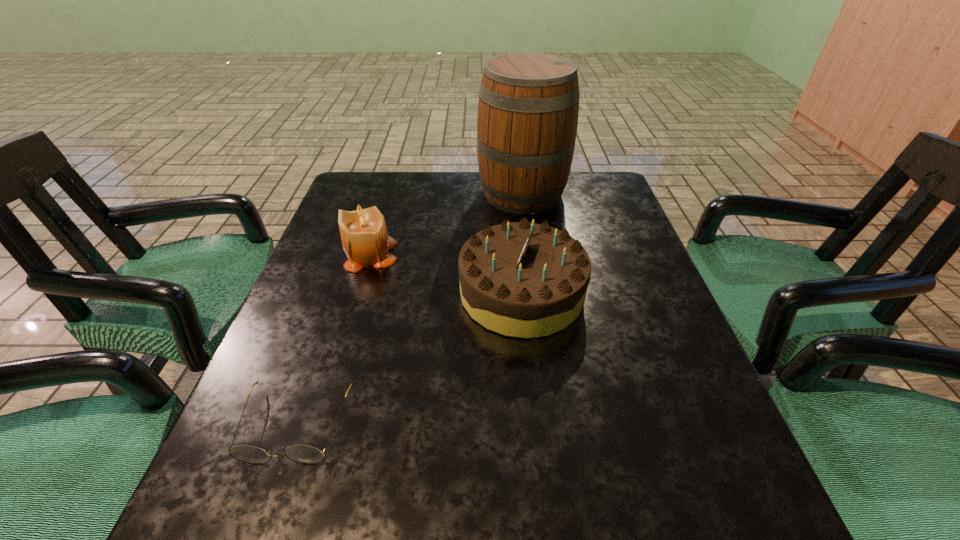
I want to click on blank space at the right edge of the desktop, so click(623, 247).

The width and height of the screenshot is (960, 540). In the image, there is a desktop. Identify the location of vacant space at the far left corner. (351, 210).

Find the location of a particular element. vacant space that is in between the candle and the birthday cake is located at coordinates (446, 274).

Where is `vacant point located between the candle and the birthday cake`? The image size is (960, 540). vacant point located between the candle and the birthday cake is located at coordinates (446, 274).

Image resolution: width=960 pixels, height=540 pixels. In order to click on vacant region between the shortest object and the cider in this screenshot , I will do `click(409, 309)`.

This screenshot has width=960, height=540. Find the location of `free space that is in between the farthest object and the candle`. free space that is in between the farthest object and the candle is located at coordinates (446, 224).

At what (x,y) coordinates should I click in order to perform the action: click on free point between the birthday cake and the candle. Please return your answer as a coordinate pair (x, y). The height and width of the screenshot is (540, 960). Looking at the image, I should click on (446, 274).

Locate an element on the screen. The image size is (960, 540). free space between the cider and the candle is located at coordinates (446, 224).

In order to click on empty space that is in between the shortest object and the cider in this screenshot , I will do `click(409, 309)`.

Locate an element on the screen. The image size is (960, 540). object that is the third closest to the farthest object is located at coordinates (303, 453).